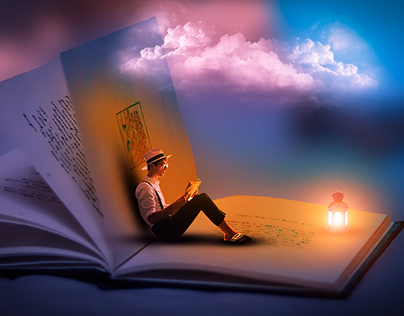
At what (x,y) coordinates should I click in order to perform the action: click on book. Please return your answer as a coordinate pair (x, y). This screenshot has height=316, width=404. Looking at the image, I should click on (182, 283).